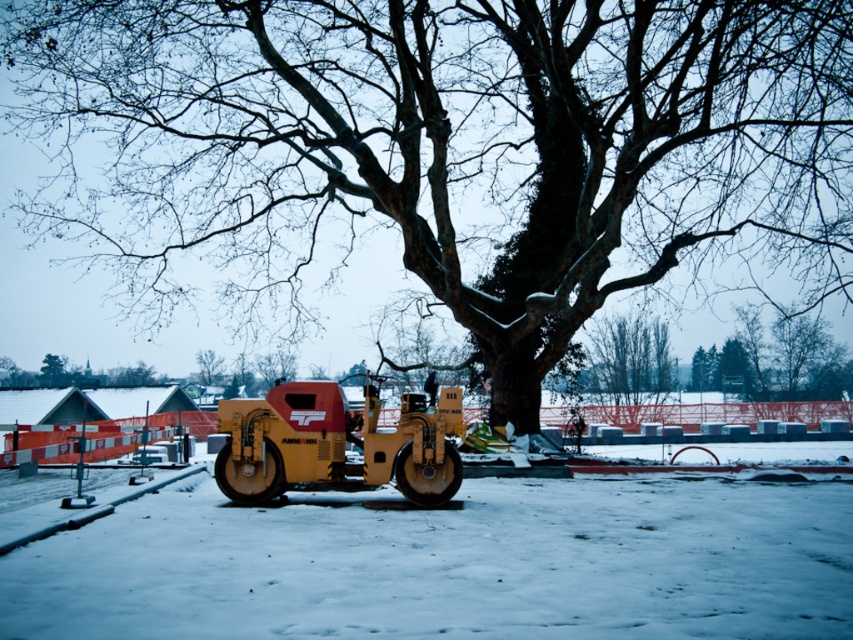
You are standing at the origin point in the winter scene. The smooth bark tree at center is at coordinates 0.228, 0.529. If you want to walk directly to the tree, which direction should you head?

The smooth bark tree at center is located at point (450,145), so you should head northeast to reach it directly.

You are a delivery person who needs to place a package between the smooth bark tree at center and the white matte snow at center. The package is 10 feet long. Is there enough space to place it without touching either object?

The distance between the smooth bark tree at center and the white matte snow at center is 23.29 feet. Since the package is only 10 feet long, there is sufficient space to place it between them without touching either object.